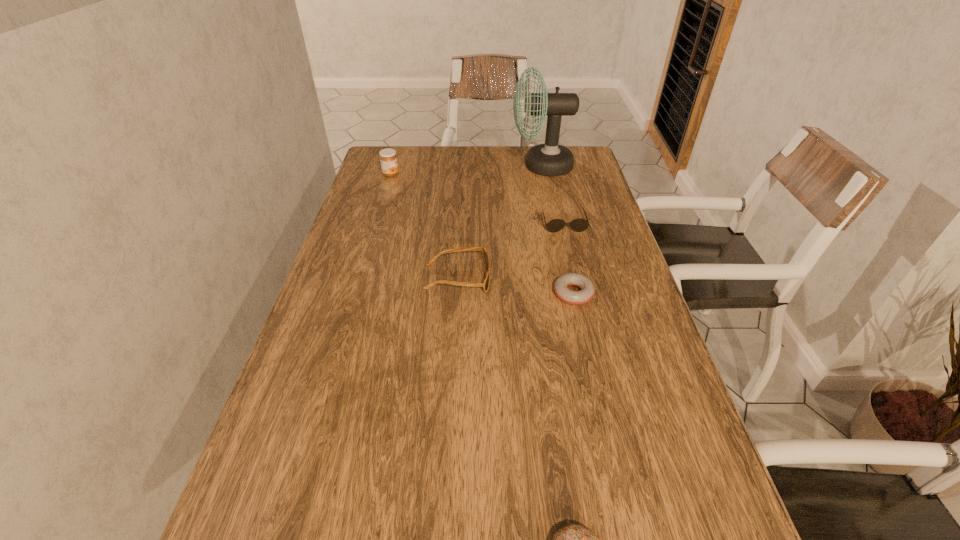
Where is `free space located 0.330m in front of the tallest object where the airflow is directed`? This screenshot has width=960, height=540. free space located 0.330m in front of the tallest object where the airflow is directed is located at coordinates (417, 166).

The height and width of the screenshot is (540, 960). In order to click on free point located 0.320m on the front label of the leftmost object in this screenshot , I will do `click(493, 174)`.

The width and height of the screenshot is (960, 540). I want to click on vacant space situated 0.120m on the front-facing side of the nearer sunglasses, so click(538, 279).

This screenshot has width=960, height=540. What are the coordinates of `free location located 0.240m on the front-facing side of the farther sunglasses` in the screenshot? It's located at (581, 292).

This screenshot has height=540, width=960. I want to click on vacant space located 0.380m on the left of the farther doughnut, so click(396, 293).

Find the location of a particular element. Image resolution: width=960 pixels, height=540 pixels. fan that is at the far edge is located at coordinates (550, 159).

Locate an element on the screen. This screenshot has width=960, height=540. jam present at the far edge is located at coordinates (388, 159).

This screenshot has height=540, width=960. I want to click on object that is at the left edge, so click(x=388, y=159).

In order to click on fan that is at the right edge in this screenshot , I will do `click(550, 159)`.

This screenshot has height=540, width=960. Find the location of `sunglasses that is at the right edge`. sunglasses that is at the right edge is located at coordinates (579, 225).